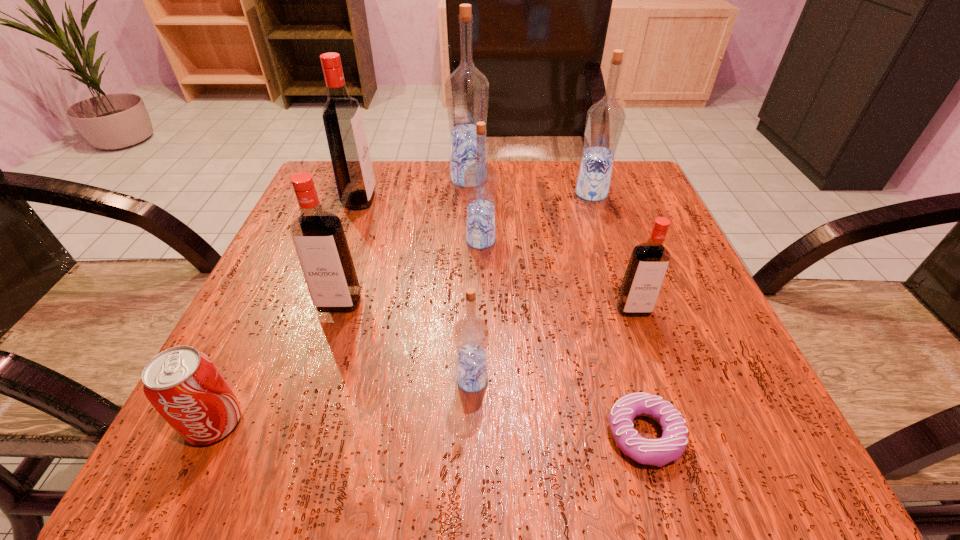
You are a GUI agent. You are given a task and a screenshot of the screen. Output one action in this format:
    pyautogui.click(x=<x>, y=<y>)
    Task: Click on the free space that is in between the purple doughnut and the biggest blue vodka
    This screenshot has height=540, width=960.
    Given the screenshot: What is the action you would take?
    pyautogui.click(x=557, y=307)

Where is `free space that is in between the seventh farthest object and the leftmost object`? The height and width of the screenshot is (540, 960). free space that is in between the seventh farthest object and the leftmost object is located at coordinates (344, 402).

Locate an element on the screen. free point between the second nearest blue vodka and the doughnut is located at coordinates (563, 338).

The width and height of the screenshot is (960, 540). I want to click on free area in between the farthest red vodka and the smallest red vodka, so click(496, 255).

This screenshot has height=540, width=960. What are the coordinates of `vacant space that's between the shortest object and the second smallest red vodka` in the screenshot? It's located at (492, 369).

Where is `vacant area that lies between the tallest object and the rightmost red vodka`? The image size is (960, 540). vacant area that lies between the tallest object and the rightmost red vodka is located at coordinates (551, 244).

The width and height of the screenshot is (960, 540). What are the coordinates of `object that stands as the fifth closest to the biggest blue vodka` in the screenshot? It's located at (649, 261).

Select which object is the fifth closest to the purple doughnut. Please provide its 2D coordinates. Your answer should be formatted as a tuple, i.e. [(x, y)], where the tuple contains the x and y coordinates of a point satisfying the conditions above.

[(184, 385)]

Where is `the fourth closest vodka to the smallest blue vodka`? The width and height of the screenshot is (960, 540). the fourth closest vodka to the smallest blue vodka is located at coordinates (345, 133).

Locate which vodka ranks fourth in proximity to the rightmost blue vodka. Please provide its 2D coordinates. Your answer should be formatted as a tuple, i.e. [(x, y)], where the tuple contains the x and y coordinates of a point satisfying the conditions above.

[(345, 133)]